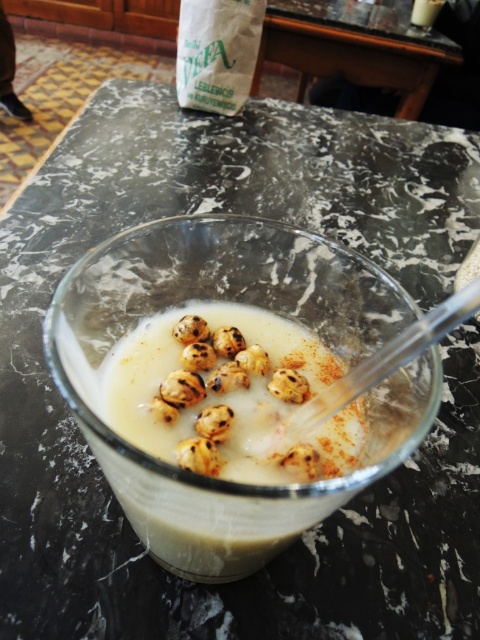
From the picture: You are a food critic evaluating the dish in the image. The brown charred balls at center and brown textured nut at center are both placed on the same glass bowl. Which one is taller?

The brown charred balls at center has a greater height compared to the brown textured nut at center, so the brown charred balls at center is taller.